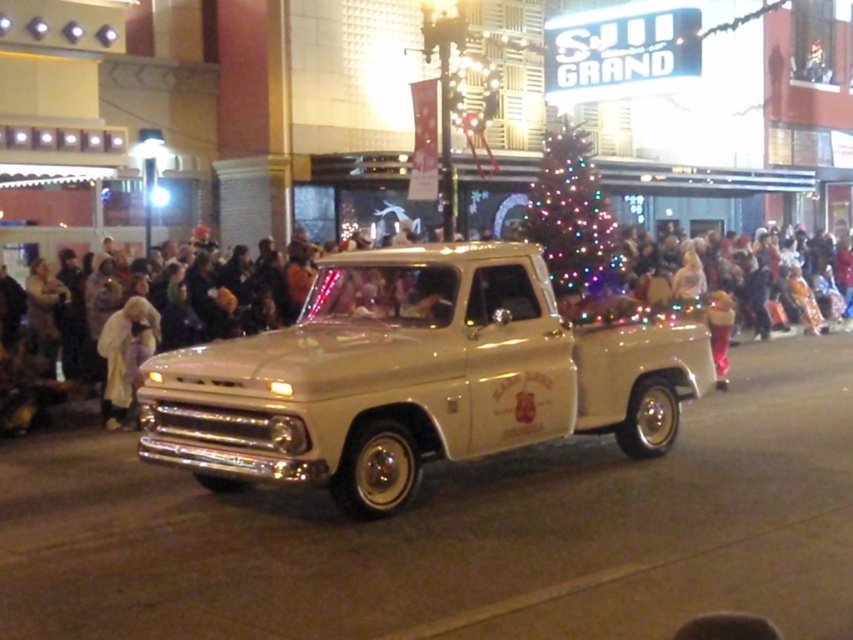
Question: Can you confirm if beige glossy truck at center is bigger than white fabric crowd at center?

Choices:
 (A) no
 (B) yes

Answer: (A)

Question: Estimate the real-world distances between objects in this image. Which object is farther from the beige glossy truck at center?

Choices:
 (A) white fabric crowd at center
 (B) illuminated glass christmas tree at center

Answer: (B)

Question: Can you confirm if beige glossy truck at center is smaller than white fabric crowd at center?

Choices:
 (A) yes
 (B) no

Answer: (A)

Question: Which object is the closest to the beige glossy truck at center?

Choices:
 (A) illuminated glass christmas tree at center
 (B) white fabric crowd at center

Answer: (B)

Question: Among these objects, which one is nearest to the camera?

Choices:
 (A) illuminated glass christmas tree at center
 (B) white fabric crowd at center
 (C) beige glossy truck at center

Answer: (C)

Question: Can you confirm if beige glossy truck at center is wider than illuminated glass christmas tree at center?

Choices:
 (A) yes
 (B) no

Answer: (A)